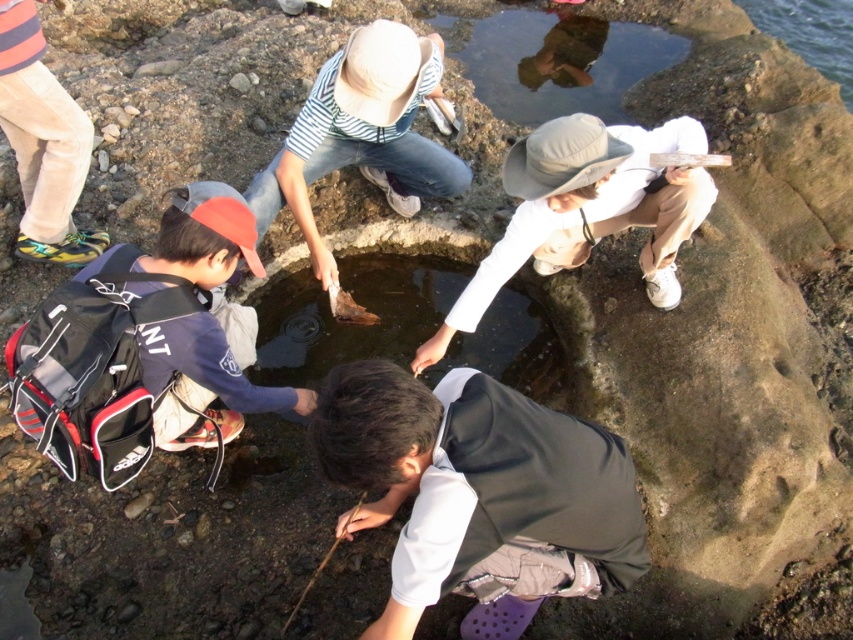
In the scene shown: Does white matte vest at center appear under clear water at center?

Correct, white matte vest at center is located below clear water at center.

How far apart are white matte vest at center and clear water at center?

1.11 meters

Who is more distant from viewer, (486, 396) or (526, 317)?

The point (526, 317) is more distant.

Where is `white matte vest at center`? The height and width of the screenshot is (640, 853). white matte vest at center is located at coordinates (479, 493).

Is white matte hat at center taller than clear water at upper right?

In fact, white matte hat at center may be shorter than clear water at upper right.

Is the position of white matte hat at center more distant than that of clear water at upper right?

No, white matte hat at center is in front of clear water at upper right.

At what (x,y) coordinates should I click in order to perform the action: click on white matte hat at center. Please return your answer as a coordinate pair (x, y). Looking at the image, I should click on (587, 209).

How much distance is there between white matte vest at center and white matte hat at center?

A distance of 36.83 inches exists between white matte vest at center and white matte hat at center.

Does white matte vest at center have a lesser width compared to white matte hat at center?

Yes.

Is point (456, 387) behind point (683, 132)?

No, (456, 387) is closer to viewer.

This screenshot has width=853, height=640. Find the location of `white matte vest at center`. white matte vest at center is located at coordinates (479, 493).